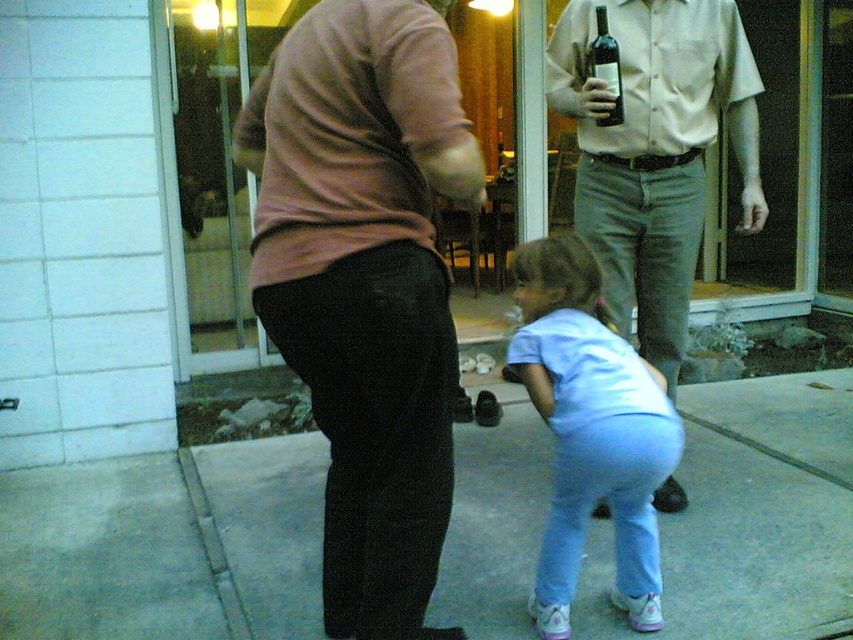
You are standing in the residential area depicted in the image. You need to determine which object is nearer to you between the matte pink sweater at center and the transparent glass door at upper center. Based on the scene, which one is closer?

The matte pink sweater at center is closer to the viewer than the transparent glass door at upper center.

You are a painter standing in front of the transparent glass door at upper center and the pink matte shirt at center. You want to paint both objects on a canvas. Which object should you paint first if you want to follow the standard painting technique of starting with the background first?

The transparent glass door at upper center should be painted first because it is in the background, while the pink matte shirt at center is in the foreground and is shorter in height than the glass door, indicating it is closer to the viewer.

You are standing at the point labeled point (218, 61) and want to walk towards the glass door in the background. There is an obstacle at point (395, 362). Will you be able to see the obstacle from your current position?

Yes, because point (395, 362) is in front of point (218, 61), so the obstacle is visible from your current position.